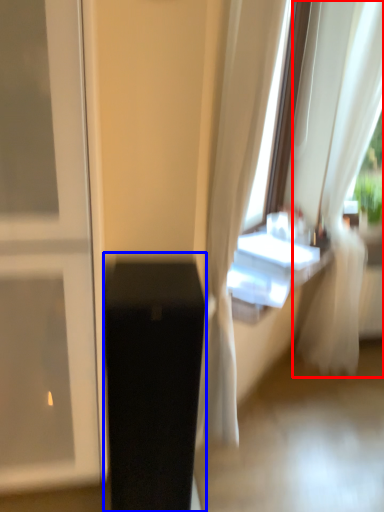
Question: Which point is further to the camera, curtain (highlighted by a red box) or furniture (highlighted by a blue box)?

Choices:
 (A) curtain
 (B) furniture

Answer: (A)